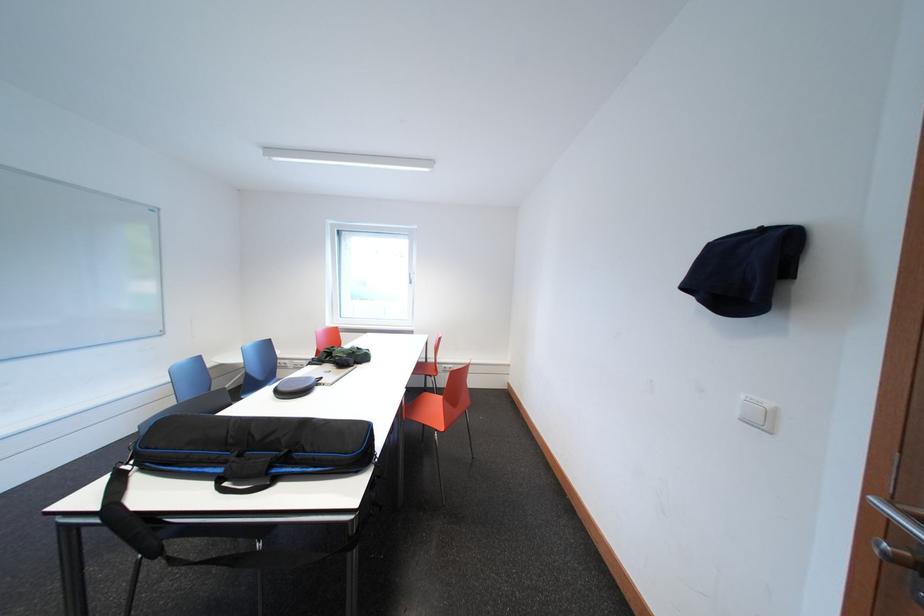
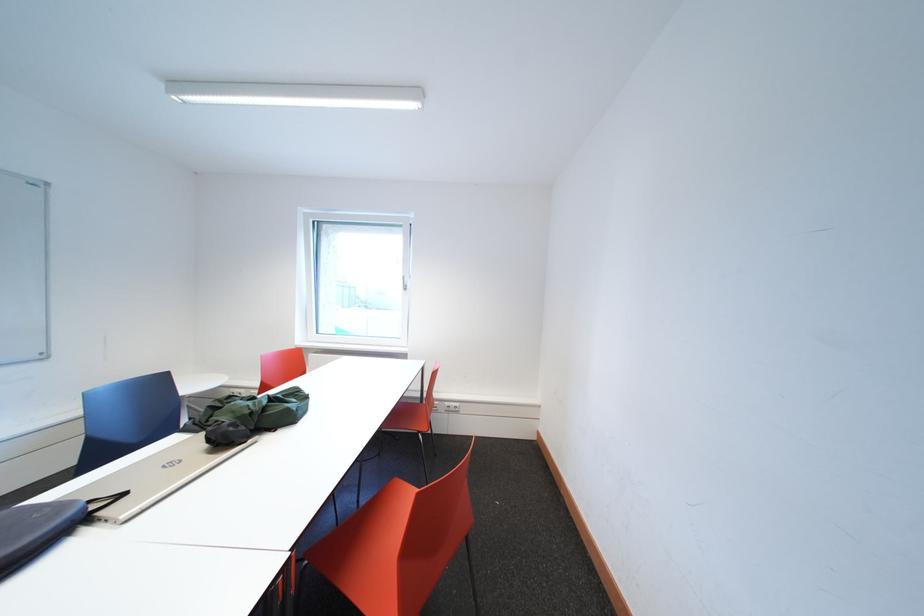
The point at (331, 382) is marked in the first image. Where is the corresponding point in the second image?

(134, 499)